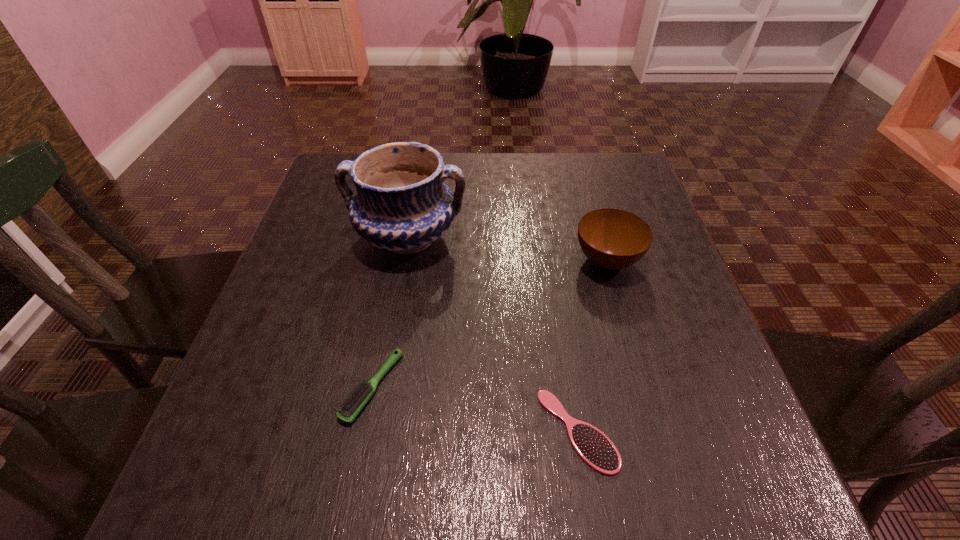
Where is `vacant space that is in between the pottery and the bowl`? The height and width of the screenshot is (540, 960). vacant space that is in between the pottery and the bowl is located at coordinates (507, 249).

Find the location of a particular element. free space between the left hairbrush and the bowl is located at coordinates (490, 323).

Identify the location of free spot between the left hairbrush and the tallest object. The width and height of the screenshot is (960, 540). (390, 312).

Where is `free space between the pottery and the taller hairbrush`? free space between the pottery and the taller hairbrush is located at coordinates (390, 312).

Identify the location of vacant space that is in between the left hairbrush and the tallest object. (390, 312).

The width and height of the screenshot is (960, 540). I want to click on vacant space that's between the bowl and the shortest object, so click(592, 346).

Where is `object that can be found as the second closest to the shorter hairbrush`? This screenshot has height=540, width=960. object that can be found as the second closest to the shorter hairbrush is located at coordinates (611, 238).

The image size is (960, 540). Identify the location of object that is the third closest one to the second tallest object. (355, 401).

Locate an element on the screen. The width and height of the screenshot is (960, 540). free region that satisfies the following two spatial constraints: 1. on the front side of the taller hairbrush; 2. on the right side of the shortest object is located at coordinates (364, 431).